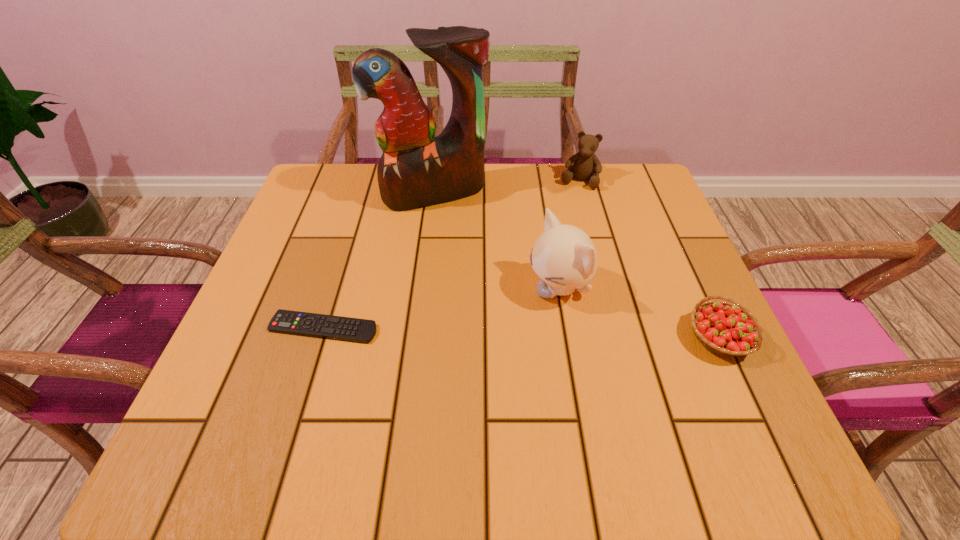
Where is `object positioned at the left edge`? The image size is (960, 540). object positioned at the left edge is located at coordinates (339, 328).

The width and height of the screenshot is (960, 540). Find the location of `strawberry positioned at the right edge`. strawberry positioned at the right edge is located at coordinates pos(729,329).

Image resolution: width=960 pixels, height=540 pixels. In order to click on teddy bear located in the right edge section of the desktop in this screenshot , I will do `click(586, 165)`.

Where is `object present at the far right corner`? The image size is (960, 540). object present at the far right corner is located at coordinates (586, 165).

Where is `object that is at the near right corner`? This screenshot has width=960, height=540. object that is at the near right corner is located at coordinates (729, 329).

At what (x,y) coordinates should I click in order to perform the action: click on blank space at the far edge. Please return your answer as a coordinate pair (x, y). The width and height of the screenshot is (960, 540). Looking at the image, I should click on (546, 186).

You are a GUI agent. You are given a task and a screenshot of the screen. Output one action in this format:
    pyautogui.click(x=<x>, y=<y>)
    Task: Click on the free space at the near edge of the desktop
    
    Given the screenshot: What is the action you would take?
    pyautogui.click(x=371, y=382)

Find the location of a particular element. Image resolution: width=960 pixels, height=540 pixels. free region at the left edge is located at coordinates (356, 226).

At what (x,y) coordinates should I click in order to perform the action: click on free space at the right edge of the desktop. Please return your answer as a coordinate pair (x, y). The width and height of the screenshot is (960, 540). Looking at the image, I should click on (684, 340).

Identify the location of vacant space at the far left corner. (327, 213).